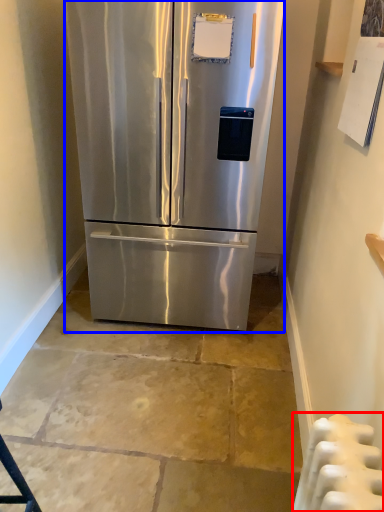
Question: Which object is closer to the camera taking this photo, radiator (highlighted by a red box) or refrigerator (highlighted by a blue box)?

Choices:
 (A) radiator
 (B) refrigerator

Answer: (A)